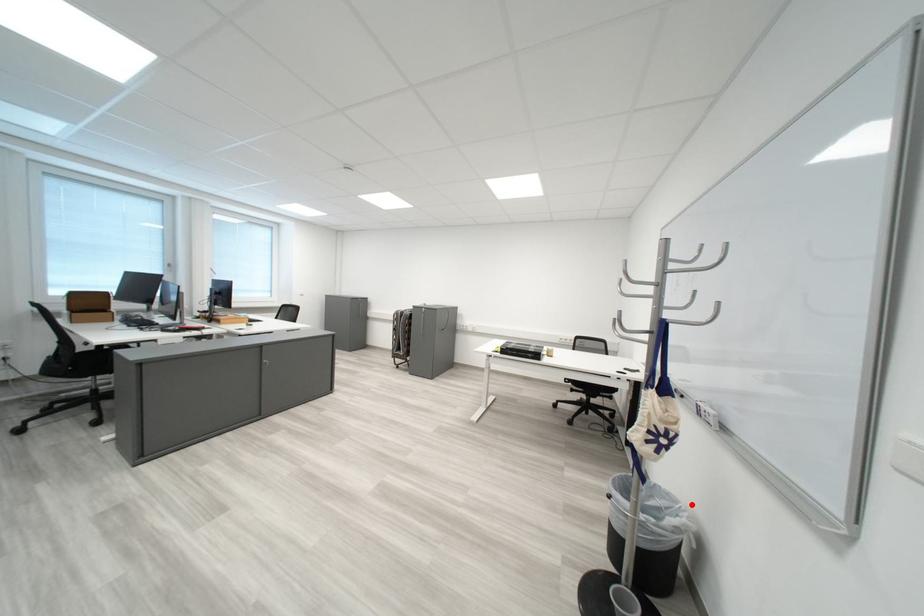
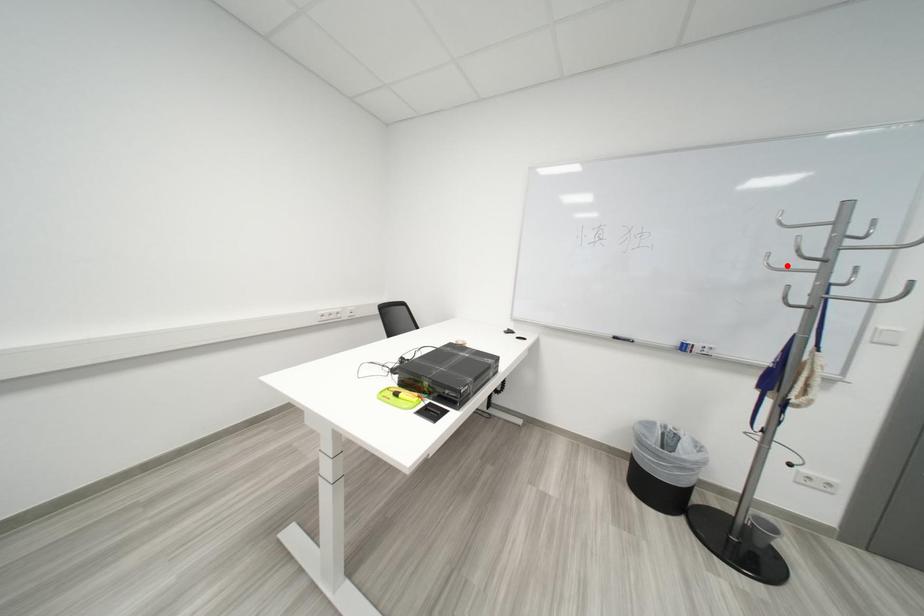
I am providing you with two images of the same scene from different viewpoints. A red point is marked on the first image and another point is marked on the second image. Do the highlighted points in image1 and image2 indicate the same real-world spot?

No